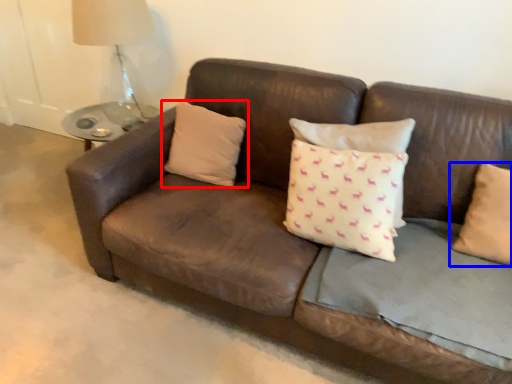
Question: Which point is further to the camera, pillow (highlighted by a red box) or pillow (highlighted by a blue box)?

Choices:
 (A) pillow
 (B) pillow

Answer: (A)